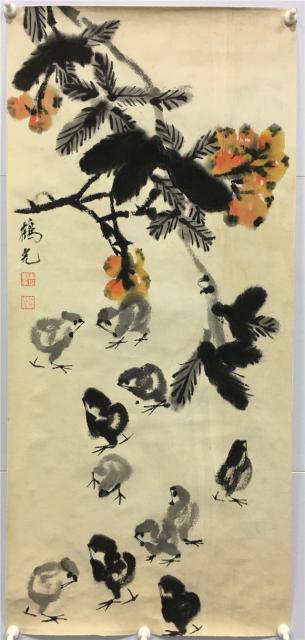
This screenshot has height=640, width=305. Identify the location of the back wall. (264, 1), (299, 521), (3, 580).